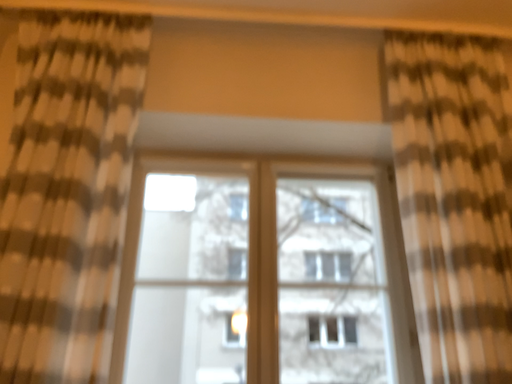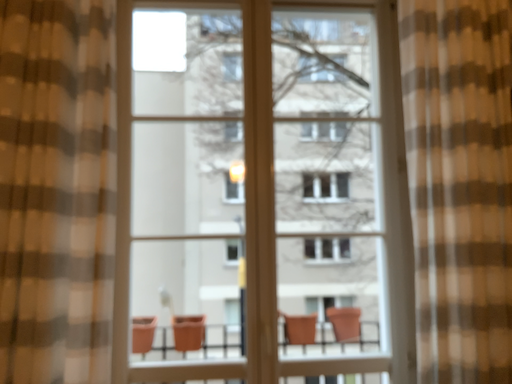
Question: How did the camera likely rotate when shooting the video?

Choices:
 (A) rotated downward
 (B) rotated upward

Answer: (A)